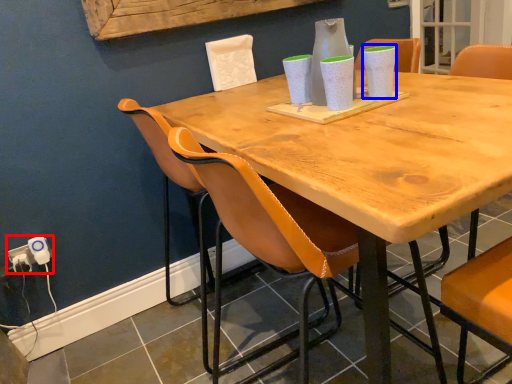
Question: Which object is closer to the camera taking this photo, electric outlet (highlighted by a red box) or vase (highlighted by a blue box)?

Choices:
 (A) electric outlet
 (B) vase

Answer: (B)